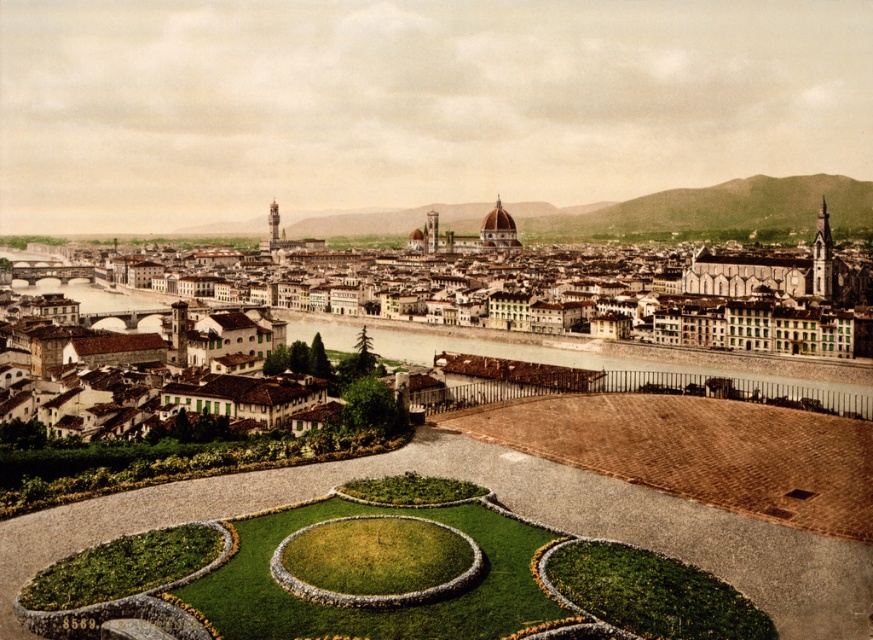
Question: Among these points, which one is farthest from the camera?

Choices:
 (A) (464, 340)
 (B) (228, 352)

Answer: (A)

Question: Observing the image, what is the correct spatial positioning of brown stone buildings at center in reference to brown concrete river at center?

Choices:
 (A) above
 (B) below

Answer: (A)

Question: Is brown stone buildings at center closer to camera compared to brown concrete river at center?

Choices:
 (A) no
 (B) yes

Answer: (A)

Question: Can you confirm if brown stone buildings at center is positioned above brown concrete river at center?

Choices:
 (A) yes
 (B) no

Answer: (A)

Question: Which object is closer to the camera taking this photo?

Choices:
 (A) brown concrete river at center
 (B) brown stone buildings at center

Answer: (A)